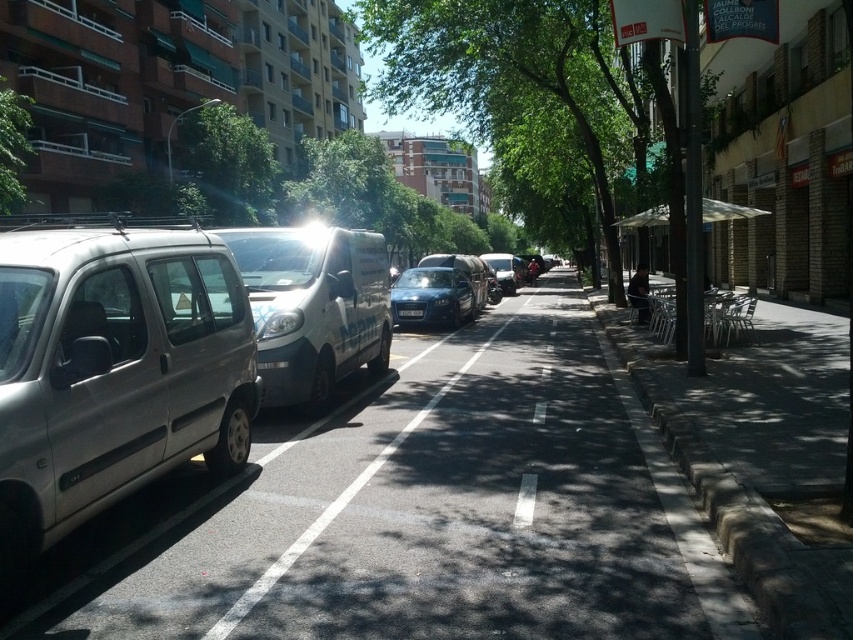
Can you confirm if green leafy tree at upper center is bigger than matte blue car at center?

Yes.

Between point (229, 145) and point (451, 296), which one is positioned behind?

Point (229, 145)

Image resolution: width=853 pixels, height=640 pixels. In order to click on green leafy tree at upper center in this screenshot , I will do `click(229, 164)`.

Is white matte van at left above blue metallic license plate at center?

Yes, white matte van at left is above blue metallic license plate at center.

Which is more to the left, white matte van at left or blue metallic license plate at center?

Positioned to the left is white matte van at left.

Is point (289, 342) farther from viewer compared to point (416, 308)?

No, it is not.

The image size is (853, 640). I want to click on white matte van at left, so click(312, 307).

Is white glossy van at center bigger than green leafy tree at upper left?

Incorrect, white glossy van at center is not larger than green leafy tree at upper left.

Is white glossy van at center closer to camera compared to green leafy tree at upper left?

Yes, white glossy van at center is closer to the viewer.

Find the location of `white glossy van at center`. white glossy van at center is located at coordinates (341, 499).